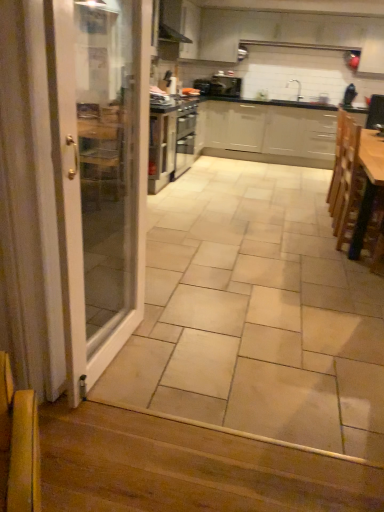
Where is `black matte exhaust hood at upper center`? Image resolution: width=384 pixels, height=512 pixels. black matte exhaust hood at upper center is located at coordinates (171, 22).

Is black matte exhaust hood at upper center wider than wooden table at right?

No, black matte exhaust hood at upper center is not wider than wooden table at right.

How much distance is there between black matte exhaust hood at upper center and wooden table at right?

black matte exhaust hood at upper center and wooden table at right are 3.33 meters apart.

From the image's perspective, is black matte exhaust hood at upper center positioned above or below wooden table at right?

Based on their image positions, black matte exhaust hood at upper center is located above wooden table at right.

What are the coordinates of `exhaust hood above the wooden table at right (from the image's perspective)` in the screenshot? It's located at (171, 22).

From the image's perspective, which object appears higher, wooden table at right or wooden at lower left?

wooden table at right, from the image's perspective.

Considering the positions of objects wooden table at right and wooden at lower left in the image provided, who is more to the left, wooden table at right or wooden at lower left?

Positioned to the left is wooden at lower left.

Is wooden table at right positioned with its back to wooden at lower left?

No, wooden table at right's orientation is not away from wooden at lower left.

Considering the sizes of objects wooden armchair at lower left and wooden table at right in the image provided, who is smaller, wooden armchair at lower left or wooden table at right?

wooden armchair at lower left.

Is wooden armchair at lower left taller or shorter than wooden table at right?

Considering their sizes, wooden armchair at lower left has less height than wooden table at right.

Considering the positions of point (368, 180) and point (34, 398), is point (368, 180) closer or farther from the camera than point (34, 398)?

Point (368, 180) is positioned farther from the camera compared to point (34, 398).

Which of these two, wooden table at right or wooden armchair at lower left, is bigger?

wooden table at right.

Is wooden table at right facing away from wooden armchair at lower left?

wooden table at right does not have its back to wooden armchair at lower left.

Who is shorter, wooden table at right or wooden armchair at lower left?

Standing shorter between the two is wooden armchair at lower left.

Could you tell me if wooden table at right is facing black matte exhaust hood at upper center?

No, wooden table at right is not oriented towards black matte exhaust hood at upper center.

Considering the sizes of objects wooden table at right and black matte exhaust hood at upper center in the image provided, who is taller, wooden table at right or black matte exhaust hood at upper center?

wooden table at right is taller.

Looking at this image, from the image's perspective, is wooden table at right on black matte exhaust hood at upper center?

Actually, wooden table at right appears below black matte exhaust hood at upper center in the image.

Is wooden table at right wider than black matte exhaust hood at upper center?

Indeed, wooden table at right has a greater width compared to black matte exhaust hood at upper center.

Is wooden armchair at lower left next to wooden at lower left?

No.

From a real-world perspective, is wooden armchair at lower left on top of wooden at lower left?

Correct, in the physical world, wooden armchair at lower left is higher than wooden at lower left.

Is point (9, 390) closer or farther from the camera than point (302, 460)?

Point (9, 390).

Considering the relative positions of wooden armchair at lower left and wooden at lower left in the image provided, is wooden armchair at lower left to the left of wooden at lower left from the viewer's perspective?

Yes.

What's the angular difference between wooden armchair at lower left and black matte exhaust hood at upper center's facing directions?

There is a 54.7-degree angle between the facing directions of wooden armchair at lower left and black matte exhaust hood at upper center.

From a real-world perspective, which object rests below the other?

wooden armchair at lower left, from a real-world perspective.

Is wooden armchair at lower left directly adjacent to black matte exhaust hood at upper center?

wooden armchair at lower left and black matte exhaust hood at upper center are not in contact.

Between wooden armchair at lower left and black matte exhaust hood at upper center, which one has more height?

Standing taller between the two is black matte exhaust hood at upper center.

In the image, there is a black matte exhaust hood at upper center. Where is `table below it (from the image's perspective)`? table below it (from the image's perspective) is located at coordinates (368, 185).

Locate an element on the screen. This screenshot has width=384, height=512. table positioned vertically above the wooden at lower left (from a real-world perspective) is located at coordinates (368, 185).

Based on their spatial positions, is black matte exhaust hood at upper center or wooden armchair at lower left closer to wooden at lower left?

Among the two, wooden armchair at lower left is located nearer to wooden at lower left.

Estimate the real-world distances between objects in this image. Which object is further from wooden table at right, black matte exhaust hood at upper center or wooden armchair at lower left?

Based on the image, black matte exhaust hood at upper center appears to be further to wooden table at right.

When comparing their distances from wooden armchair at lower left, does wooden table at right or black matte exhaust hood at upper center seem further?

black matte exhaust hood at upper center.

Considering their positions, is black matte exhaust hood at upper center positioned closer to wooden table at right than beige ceramic tile at center?

beige ceramic tile at center is positioned closer to the anchor wooden table at right.

Looking at the image, which one is located further to wooden table at right, black matte exhaust hood at upper center or wooden at lower left?

black matte exhaust hood at upper center lies further to wooden table at right than the other object.

Considering their positions, is beige ceramic tile at center positioned further to wooden at lower left than wooden armchair at lower left?

Based on the image, beige ceramic tile at center appears to be further to wooden at lower left.

Based on their spatial positions, is black matte exhaust hood at upper center or wooden at lower left further from wooden armchair at lower left?

black matte exhaust hood at upper center.

When comparing their distances from wooden armchair at lower left, does wooden table at right or wooden at lower left seem closer?

Based on the image, wooden at lower left appears to be nearer to wooden armchair at lower left.

The height and width of the screenshot is (512, 384). I want to click on ceramic tile between black matte exhaust hood at upper center and wooden at lower left from top to bottom, so click(x=256, y=314).

The height and width of the screenshot is (512, 384). Identify the location of table between black matte exhaust hood at upper center and wooden at lower left in the up-down direction. pos(368,185).

Image resolution: width=384 pixels, height=512 pixels. What are the coordinates of `ceramic tile between wooden armchair at lower left and wooden table at right` in the screenshot? It's located at (256, 314).

Where is `ceramic tile between wooden armchair at lower left and black matte exhaust hood at upper center along the z-axis`? ceramic tile between wooden armchair at lower left and black matte exhaust hood at upper center along the z-axis is located at coordinates (256, 314).